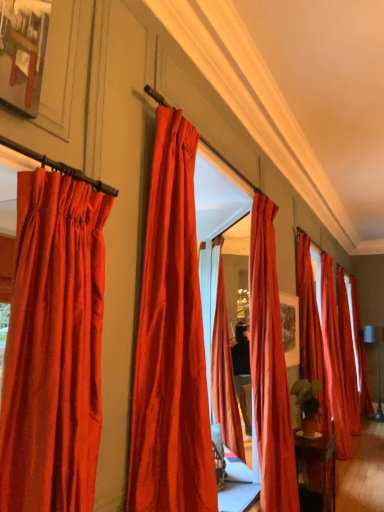
Question: Is satin red curtain at left, placed as the seventh curtain when sorted from back to front, wider or thinner than satin red curtain at center, positioned as the 3th curtain in front-to-back order?

Choices:
 (A) wide
 (B) thin

Answer: (B)

Question: Is satin red curtain at left, which is the seventh curtain from right to left, bigger or smaller than satin red curtain at center, which ranks as the 3th curtain in left-to-right order?

Choices:
 (A) big
 (B) small

Answer: (B)

Question: Considering the real-world distances, which object is farthest from the satin red curtain at right, which is the fourth curtain from back to front?

Choices:
 (A) satin red curtain at center, which is the sixth curtain in right-to-left order
 (B) satin red curtain at center, the fifth curtain positioned from the back
 (C) satin red curtain at right, marked as the sixth curtain in a left-to-right arrangement
 (D) satin red curtain at right, the fifth curtain from the left
 (E) satin red curtain at left, which is the seventh curtain from right to left

Answer: (E)

Question: Which of these objects is positioned farthest from the satin red curtain at right, the 6th curtain from the front?

Choices:
 (A) satin red curtain at center, the 6th curtain when ordered from back to front
 (B) satin red curtain at right, the 4th curtain when ordered from front to back
 (C) satin red curtain at right, the 3th curtain positioned from the back
 (D) satin red curtain at right, the first curtain from the back
 (E) satin red curtain at center, the fifth curtain positioned from the back

Answer: (A)